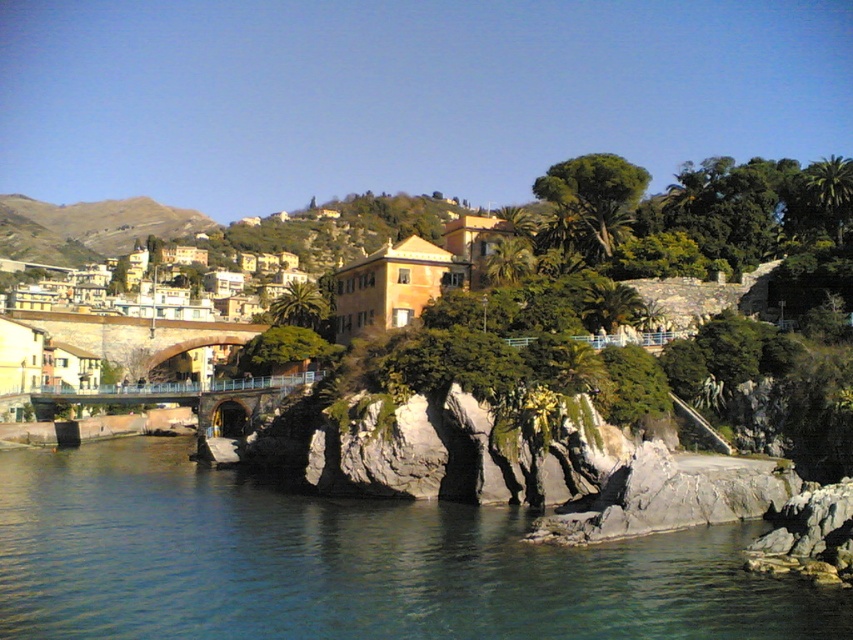
Based on the photo, does clear water at lower left have a greater width compared to yellowish stucco houses at upper left?

In fact, clear water at lower left might be narrower than yellowish stucco houses at upper left.

Identify the location of clear water at lower left. The width and height of the screenshot is (853, 640). (347, 563).

Between yellowish stucco houses at upper left and metallic bridge at center, which one appears on the left side from the viewer's perspective?

From the viewer's perspective, yellowish stucco houses at upper left appears more on the left side.

Does point (142, 208) come behind point (196, 404)?

Yes, it is behind point (196, 404).

Where is `yellowish stucco houses at upper left`? This screenshot has width=853, height=640. yellowish stucco houses at upper left is located at coordinates (86, 227).

Can you confirm if clear water at lower left is thinner than yellow stucco houses at upper left?

Indeed, clear water at lower left has a lesser width compared to yellow stucco houses at upper left.

Between clear water at lower left and yellow stucco houses at upper left, which one is positioned higher?

→ Positioned higher is yellow stucco houses at upper left.

Does point (115, 508) lie in front of point (247, 298)?

Yes.

Find the location of a particular element. This screenshot has height=640, width=853. clear water at lower left is located at coordinates (347, 563).